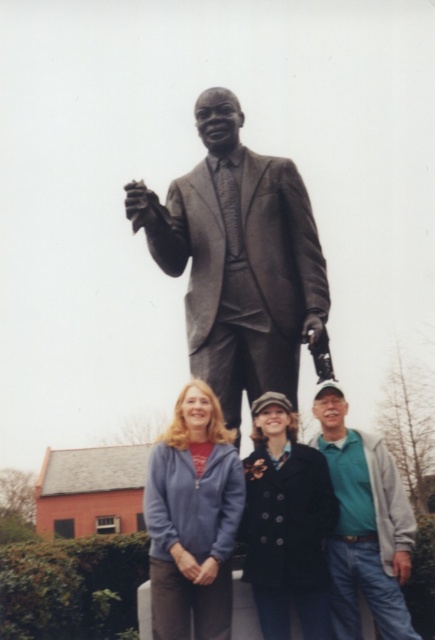
Does bronze statue at center appear on the left side of teal-green shirt at lower right?

Indeed, bronze statue at center is positioned on the left side of teal-green shirt at lower right.

Who is higher up, bronze statue at center or teal-green shirt at lower right?

bronze statue at center is above.

Describe the element at coordinates (238, 259) in the screenshot. The image size is (435, 640). I see `bronze statue at center` at that location.

Find the location of a particular element. Image resolution: width=435 pixels, height=640 pixels. bronze statue at center is located at coordinates (238, 259).

What do you see at coordinates (285, 524) in the screenshot? I see `dark blue wool coat at center` at bounding box center [285, 524].

Who is more forward, (261,557) or (412,538)?

Point (261,557) is more forward.

You are a GUI agent. You are given a task and a screenshot of the screen. Output one action in this format:
    pyautogui.click(x=<x>, y=<y>)
    Task: Click on the dark blue wool coat at center
    
    Given the screenshot: What is the action you would take?
    pyautogui.click(x=285, y=524)

What do you see at coordinates (238, 259) in the screenshot? This screenshot has width=435, height=640. I see `bronze statue at center` at bounding box center [238, 259].

Does bronze statue at center have a lesser width compared to dark blue wool coat at center?

In fact, bronze statue at center might be wider than dark blue wool coat at center.

Locate an element on the screen. This screenshot has width=435, height=640. bronze statue at center is located at coordinates (238, 259).